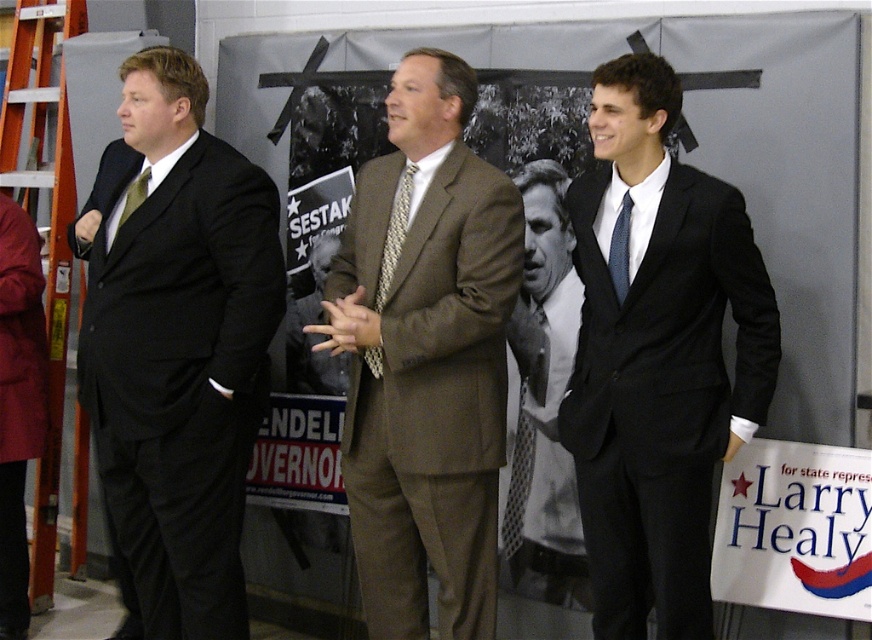
Question: Is white shirt with checkered tie at center to the left of blue dotted tie at right from the viewer's perspective?

Choices:
 (A) no
 (B) yes

Answer: (B)

Question: Is white shirt with checkered tie at center thinner than green silk tie at left?

Choices:
 (A) yes
 (B) no

Answer: (B)

Question: Which of the following is the farthest from the observer?

Choices:
 (A) (280, 276)
 (B) (128, 184)

Answer: (B)

Question: Can you confirm if brown textured suit at center is smaller than white shirt with checkered tie at center?

Choices:
 (A) no
 (B) yes

Answer: (A)

Question: Which object appears farthest from the camera in this image?

Choices:
 (A) black and white poster at center
 (B) matte black suit at right

Answer: (A)

Question: Which of the following is the closest to the observer?

Choices:
 (A) matte black suit at left
 (B) green silk tie at left
 (C) white paper sign at lower right
 (D) white shirt with checkered tie at center

Answer: (A)